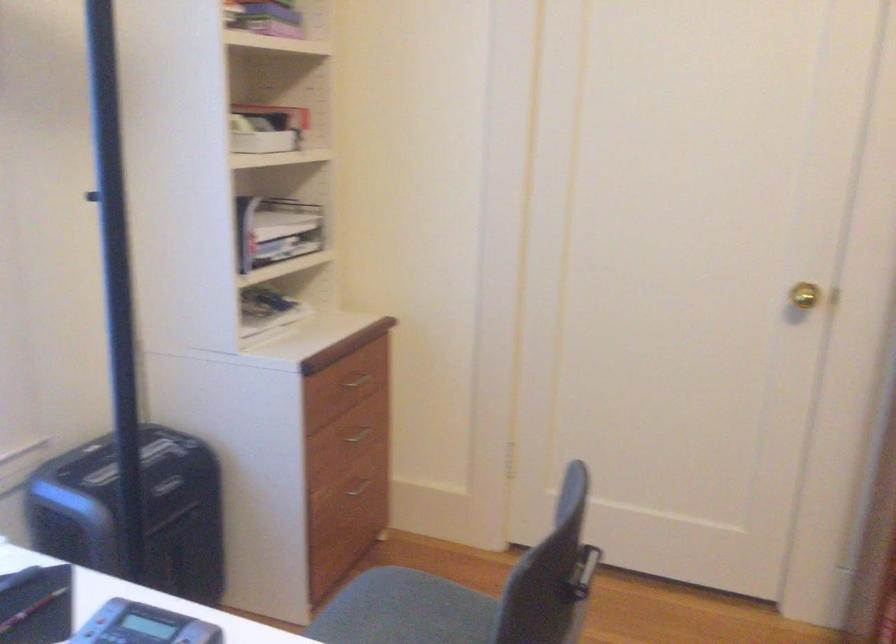
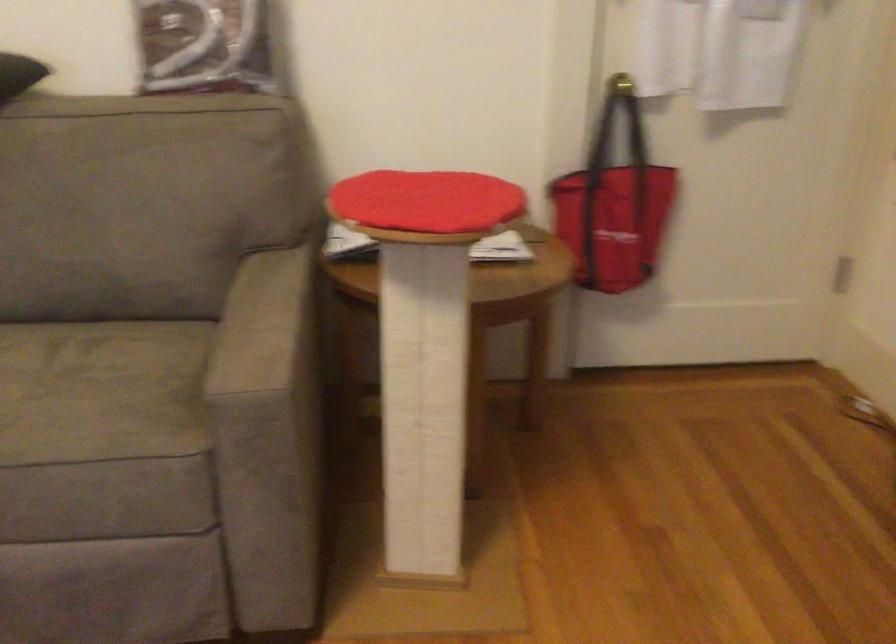
The images are taken continuously from a first-person perspective. In which direction is your viewpoint rotating?

The camera rotated toward right-down.